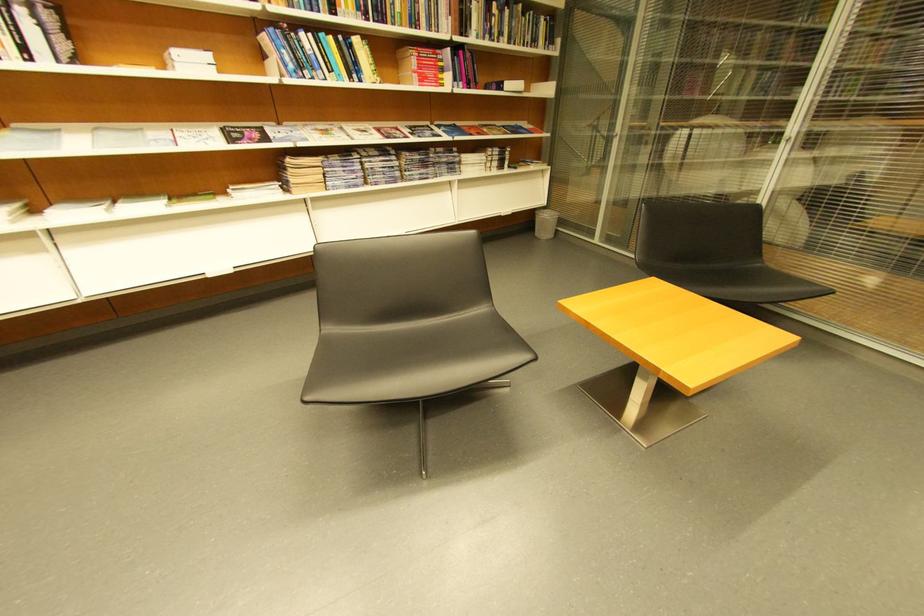
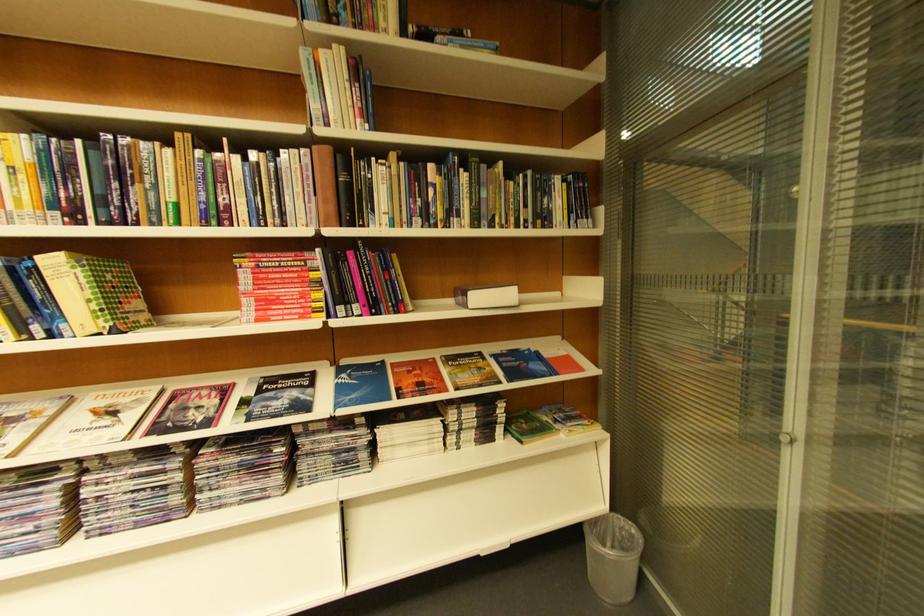
Locate, in the second image, the point that corresponds to (x=544, y=45) in the first image.

(554, 221)